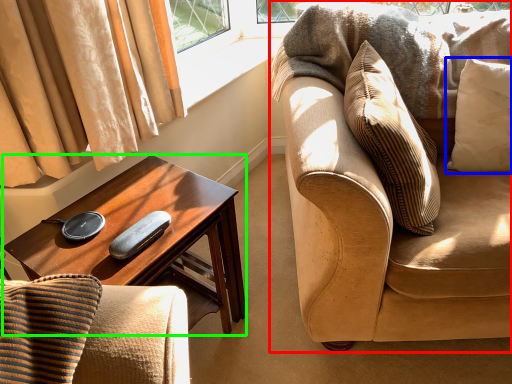
Question: Which object is positioned closest to studio couch (highlighted by a red box)? Select from pillow (highlighted by a blue box) and desk (highlighted by a green box).

Choices:
 (A) pillow
 (B) desk

Answer: (A)